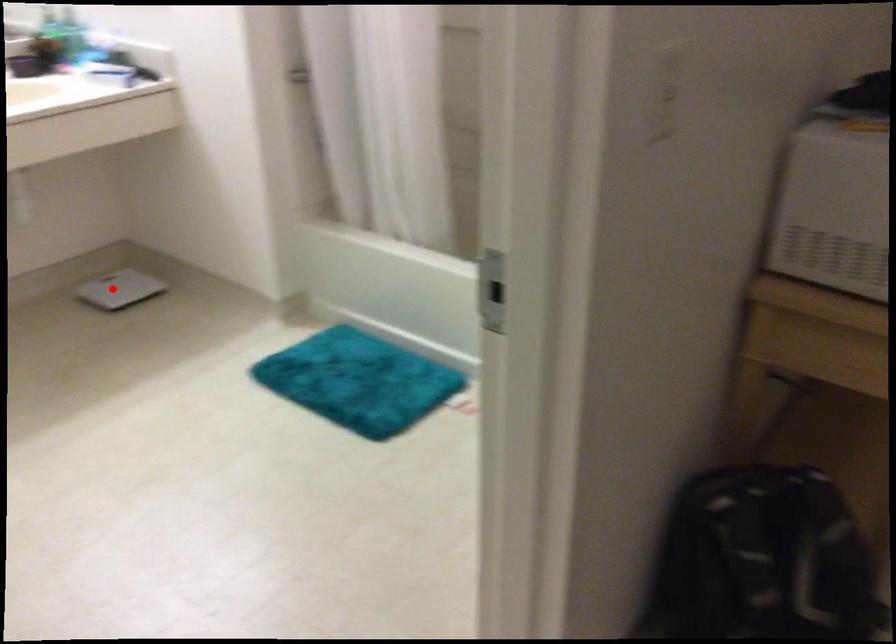
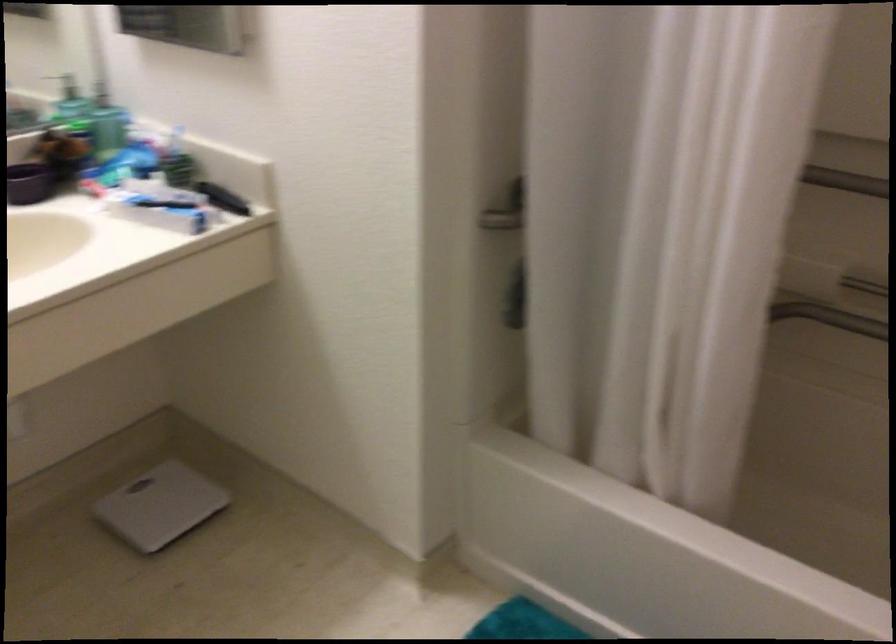
Question: I am providing you with two images of the same scene from different viewpoints. Given a red point in image1, look at the same physical point in image2. Is it:

Choices:
 (A) Closer to the viewpoint
 (B) Farther from the viewpoint

Answer: (A)